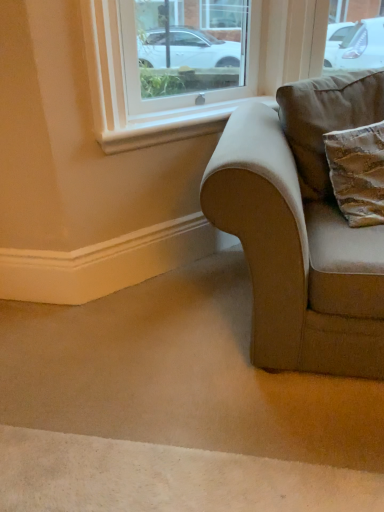
Question: Is brown suede pillow at right far from white smooth window sill at upper center?

Choices:
 (A) yes
 (B) no

Answer: (B)

Question: Is brown suede pillow at right smaller than white smooth window sill at upper center?

Choices:
 (A) yes
 (B) no

Answer: (B)

Question: From the image's perspective, is brown suede pillow at right above white smooth window sill at upper center?

Choices:
 (A) no
 (B) yes

Answer: (A)

Question: Does brown suede pillow at right appear on the right side of white smooth window sill at upper center?

Choices:
 (A) no
 (B) yes

Answer: (B)

Question: Is brown suede pillow at right located outside white smooth window sill at upper center?

Choices:
 (A) yes
 (B) no

Answer: (A)

Question: Can you confirm if brown suede pillow at right is taller than white smooth window sill at upper center?

Choices:
 (A) yes
 (B) no

Answer: (A)

Question: From a real-world perspective, does velvet beige couch at lower right stand above white smooth window sill at upper center?

Choices:
 (A) no
 (B) yes

Answer: (A)

Question: Is velvet beige couch at lower right aimed at white smooth window sill at upper center?

Choices:
 (A) yes
 (B) no

Answer: (B)

Question: Is velvet beige couch at lower right positioned with its back to white smooth window sill at upper center?

Choices:
 (A) yes
 (B) no

Answer: (B)

Question: Is there a large distance between velvet beige couch at lower right and white smooth window sill at upper center?

Choices:
 (A) yes
 (B) no

Answer: (B)

Question: Can you confirm if velvet beige couch at lower right is positioned to the left of white smooth window sill at upper center?

Choices:
 (A) no
 (B) yes

Answer: (A)

Question: Is white smooth window sill at upper center inside velvet beige couch at lower right?

Choices:
 (A) yes
 (B) no

Answer: (B)

Question: Does white smooth window sill at upper center have a larger size compared to brown suede pillow at right?

Choices:
 (A) no
 (B) yes

Answer: (A)